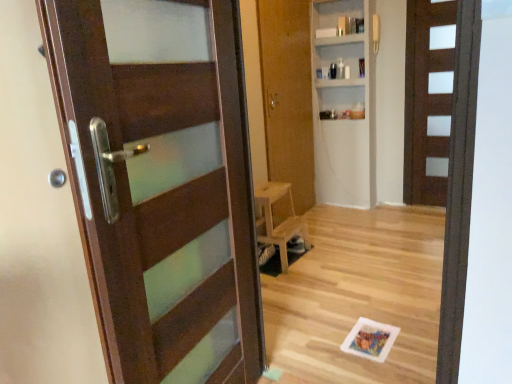
Question: Is wooden chair at center bigger or smaller than matte brown door at left, positioned as the third door in right-to-left order?

Choices:
 (A) small
 (B) big

Answer: (A)

Question: From a real-world perspective, is wooden chair at center physically located above or below matte brown door at left, positioned as the 3th door in back-to-front order?

Choices:
 (A) above
 (B) below

Answer: (B)

Question: Estimate the real-world distances between objects in this image. Which object is farther from the matte brown door at left, positioned as the 1th door in left-to-right order?

Choices:
 (A) wooden door at center, which ranks as the second door in left-to-right order
 (B) wooden chair at center
 (C) brown matte door at right, arranged as the third door when viewed from the front
 (D) white matte bookshelf at upper center

Answer: (C)

Question: Considering the real-world distances, which object is closest to the brown matte door at right, which is counted as the 1th door, starting from the right?

Choices:
 (A) white matte bookshelf at upper center
 (B) matte brown door at left, acting as the 1th door starting from the front
 (C) wooden door at center, the second door positioned from the back
 (D) wooden chair at center

Answer: (A)